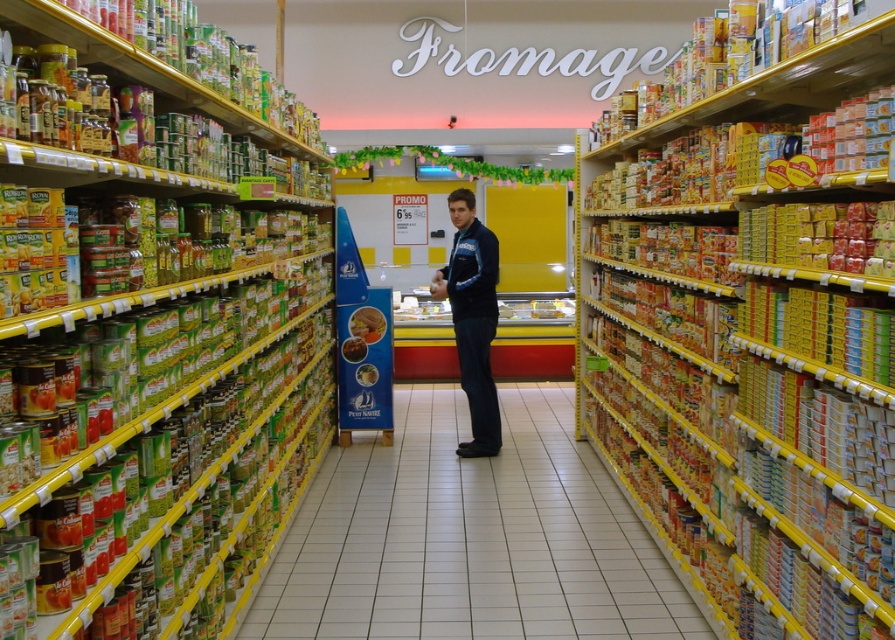
Question: Can you confirm if metallic cans at left is thinner than metallic yellow shelf at right?

Choices:
 (A) yes
 (B) no

Answer: (A)

Question: Which object is farther from the camera taking this photo?

Choices:
 (A) green matte jar at center
 (B) metallic cans at left
 (C) smooth plastic butter at center

Answer: (A)

Question: Which of the following is the farthest from the observer?

Choices:
 (A) blue fabric jacket at center
 (B) green matte cans at center
 (C) metallic yellow shelf at right
 (D) metallic cans at left

Answer: (A)

Question: Is metallic cans at left thinner than green matte jar at center?

Choices:
 (A) yes
 (B) no

Answer: (B)

Question: Is matte plastic container at center bigger than green matte jar at center?

Choices:
 (A) yes
 (B) no

Answer: (A)

Question: Estimate the real-world distances between objects in this image. Which object is farther from the metallic yellow shelf at right?

Choices:
 (A) matte plastic container at center
 (B) green matte cans at center
 (C) metallic cans at left
 (D) smooth plastic butter at center

Answer: (A)